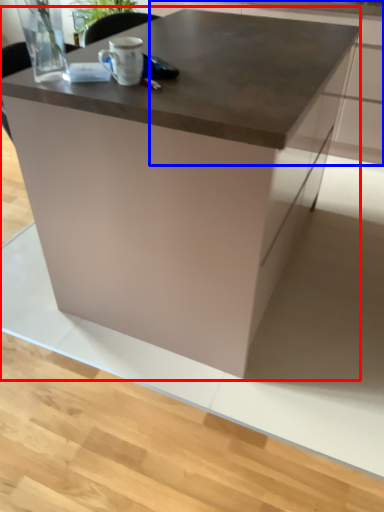
Question: Which object is closer to the camera taking this photo, table (highlighted by a red box) or cabinetry (highlighted by a blue box)?

Choices:
 (A) table
 (B) cabinetry

Answer: (A)